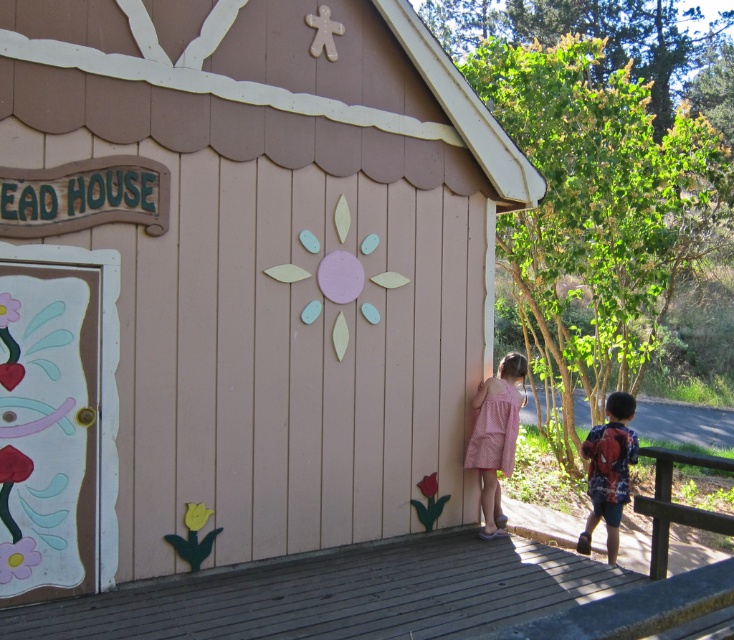
You are a visitor standing at the entrance of the wooden hut at center. You want to take a photo of the pink dotted dress at lower right without any obstruction. Can you do this? Explain why or why not.

The wooden hut at center is taller than the pink dotted dress at lower right. Since the hut is taller, it might block the view of the dress unless you move to a position where the hut is not in between you and the dress.